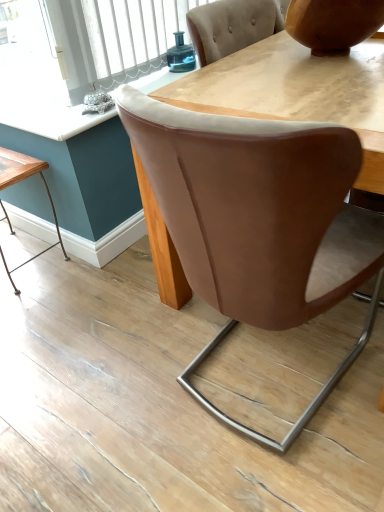
In order to click on free spot to the left of matte brown vase at upper right in this screenshot , I will do `click(246, 68)`.